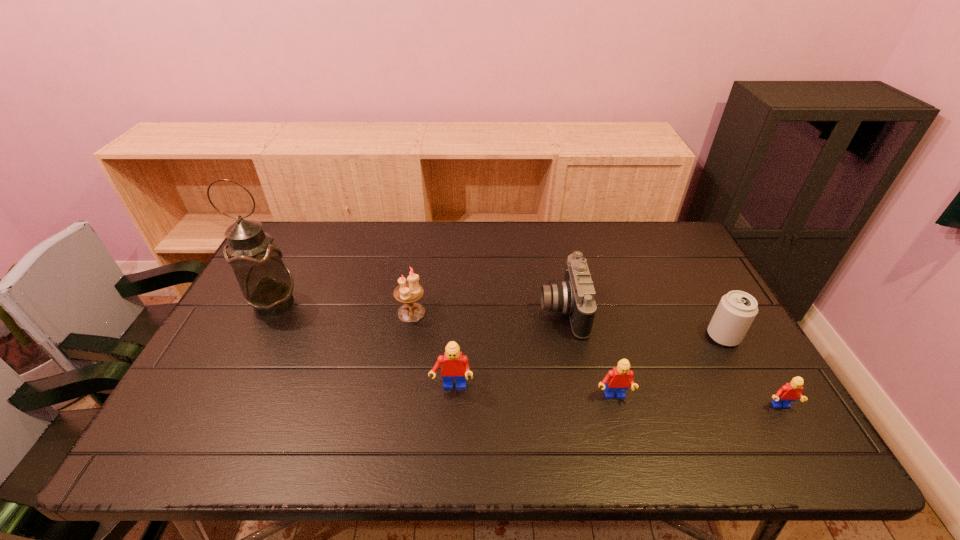
You are a GUI agent. You are given a task and a screenshot of the screen. Output one action in this format:
    pyautogui.click(x=<x>, y=<y>)
    Task: Click on the free location located on the back of the can
    This screenshot has width=960, height=540.
    Given the screenshot: What is the action you would take?
    pyautogui.click(x=678, y=254)

Identify the location of vacant space located on the front-facing side of the camera. (429, 310).

Find the location of `free space located on the front-facing side of the camera`. free space located on the front-facing side of the camera is located at coordinates (457, 310).

You are a GUI agent. You are given a task and a screenshot of the screen. Output one action in this format:
    pyautogui.click(x=<x>, y=<y>)
    Task: Click on the vacant space located 0.170m on the front-facing side of the camera
    
    Given the screenshot: What is the action you would take?
    pyautogui.click(x=481, y=310)

Locate an element on the screen. This screenshot has width=960, height=540. free location located 0.170m on the front of the candle holder is located at coordinates (401, 373).

You are a GUI agent. You are given a task and a screenshot of the screen. Output one action in this format:
    pyautogui.click(x=<x>, y=<y>)
    Task: Click on the vacant space located 0.320m on the right of the leftmost object
    
    Given the screenshot: What is the action you would take?
    pyautogui.click(x=407, y=303)

Locate an element on the screen. This screenshot has width=960, height=540. object that is at the left edge is located at coordinates (266, 282).

Where is `Lego that is at the right edge`? Image resolution: width=960 pixels, height=540 pixels. Lego that is at the right edge is located at coordinates (791, 391).

This screenshot has width=960, height=540. Find the location of `can that is at the right edge`. can that is at the right edge is located at coordinates (736, 310).

Locate an element on the screen. This screenshot has width=960, height=540. object located in the near right corner section of the desktop is located at coordinates (791, 391).